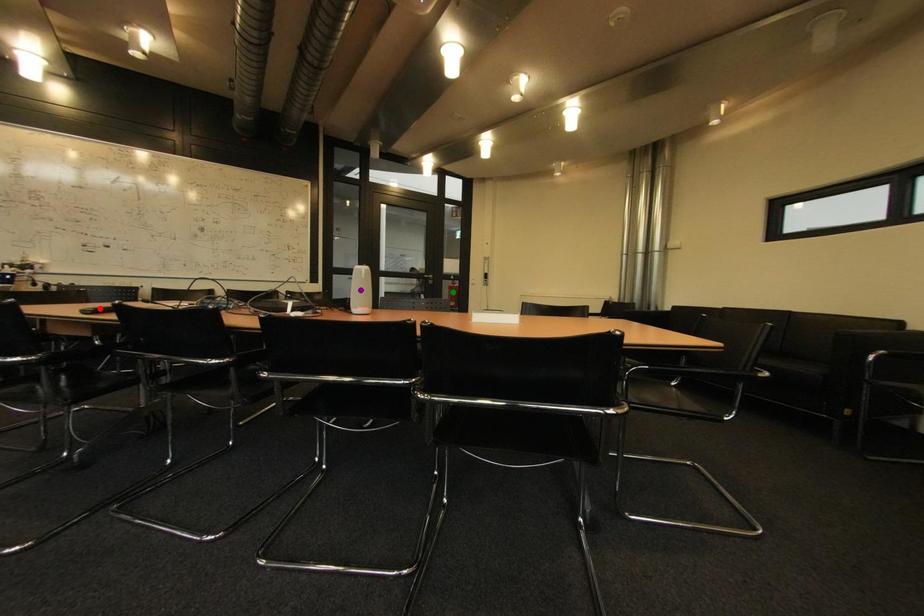
Order these from nearest to farthest:
- purple point
- green point
- red point

red point → purple point → green point